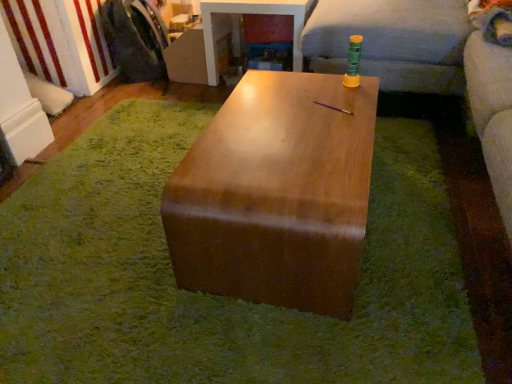
Question: From a real-world perspective, is glossy wood table at center, which is the 1th table in back-to-front order, located higher than brushed metal washing machine at left?

Choices:
 (A) no
 (B) yes

Answer: (A)

Question: Could you tell me if glossy wood table at center, the first table viewed from the top, is turned towards brushed metal washing machine at left?

Choices:
 (A) yes
 (B) no

Answer: (B)

Question: Is glossy wood table at center, which is the 2th table from bottom to top, completely or partially outside of brushed metal washing machine at left?

Choices:
 (A) yes
 (B) no

Answer: (A)

Question: From the image's perspective, is glossy wood table at center, which is the 1th table in back-to-front order, below brushed metal washing machine at left?

Choices:
 (A) no
 (B) yes

Answer: (B)

Question: Is glossy wood table at center, which is the 1th table in back-to-front order, thinner than brushed metal washing machine at left?

Choices:
 (A) no
 (B) yes

Answer: (A)

Question: Considering the relative positions of glossy wood table at center, the first table viewed from the top, and brushed metal washing machine at left in the image provided, is glossy wood table at center, the first table viewed from the top, behind brushed metal washing machine at left?

Choices:
 (A) no
 (B) yes

Answer: (A)

Question: Would you say soft gray fabric couch at upper right is outside glossy wood table at center, arranged as the first table when viewed from the front?

Choices:
 (A) no
 (B) yes

Answer: (B)

Question: Considering the relative positions of soft gray fabric couch at upper right and glossy wood table at center, arranged as the first table when viewed from the front, in the image provided, is soft gray fabric couch at upper right behind glossy wood table at center, arranged as the first table when viewed from the front,?

Choices:
 (A) no
 (B) yes

Answer: (B)

Question: Does soft gray fabric couch at upper right turn towards glossy wood table at center, arranged as the first table when viewed from the front?

Choices:
 (A) no
 (B) yes

Answer: (A)

Question: Is soft gray fabric couch at upper right placed right next to glossy wood table at center, the second table viewed from the back?

Choices:
 (A) no
 (B) yes

Answer: (A)

Question: Would you say soft gray fabric couch at upper right is a long distance from glossy wood table at center, the 2th table when ordered from top to bottom?

Choices:
 (A) yes
 (B) no

Answer: (B)

Question: From the image's perspective, would you say soft gray fabric couch at upper right is shown under glossy wood table at center, which appears as the 1th table when ordered from the bottom?

Choices:
 (A) yes
 (B) no

Answer: (B)

Question: Does glossy wood table at center, the first table viewed from the top, appear on the left side of wooden table at center?

Choices:
 (A) yes
 (B) no

Answer: (B)